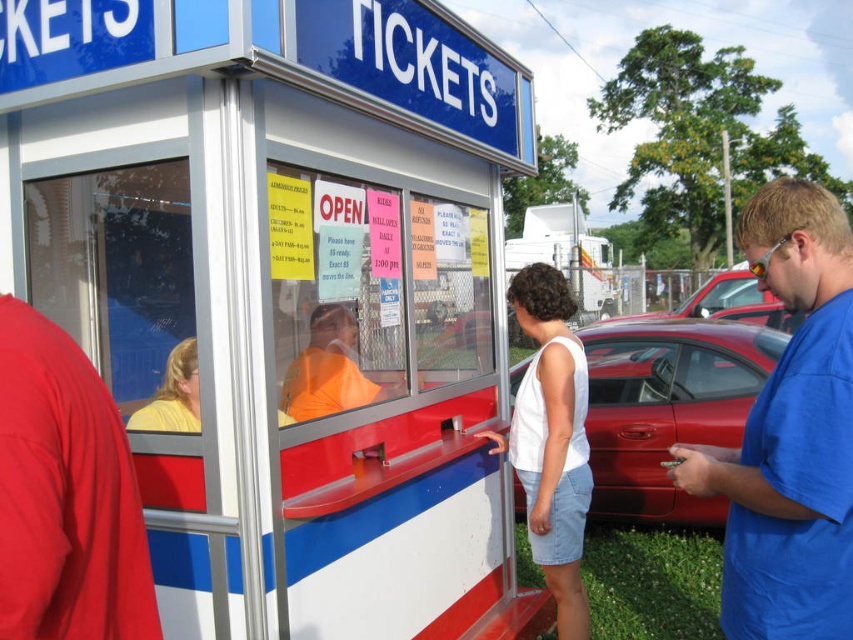
Question: Is metallic red booth at center wider than shiny red car at center?

Choices:
 (A) no
 (B) yes

Answer: (B)

Question: Which of the following is the closest to the observer?

Choices:
 (A) (312, 413)
 (B) (196, 12)
 (C) (534, 404)
 (D) (755, 426)

Answer: (D)

Question: Which point is closer to the camera?

Choices:
 (A) orange shirt at center
 (B) white cotton tank top at center
 (C) metallic red booth at center
 (D) blue cotton shirt at right

Answer: (D)

Question: Is blue cotton shirt at right to the left of orange shirt at center from the viewer's perspective?

Choices:
 (A) yes
 (B) no

Answer: (B)

Question: Which object is closer to the camera taking this photo?

Choices:
 (A) orange shirt at center
 (B) blue cotton shirt at right
 (C) metallic red booth at center
 (D) white cotton tank top at center

Answer: (B)

Question: Does metallic red booth at center lie in front of blue cotton shirt at right?

Choices:
 (A) no
 (B) yes

Answer: (A)